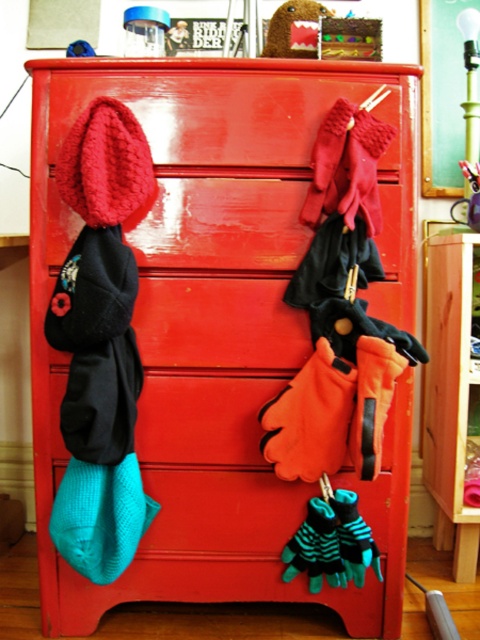
Question: Which point appears farthest from the camera in this image?

Choices:
 (A) (271, 45)
 (B) (68, 538)
 (C) (451, 212)

Answer: (C)

Question: Is teal knitted sock at lower left thinner than metallic silver scissors at upper right?

Choices:
 (A) yes
 (B) no

Answer: (B)

Question: Which of the following is the closest to the observer?

Choices:
 (A) metallic silver scissors at upper right
 (B) teal knitted sock at lower left

Answer: (B)

Question: Does teal knitted sock at lower left appear under metallic silver scissors at upper right?

Choices:
 (A) no
 (B) yes

Answer: (B)

Question: Which object appears farthest from the camera in this image?

Choices:
 (A) teal knitted sock at lower left
 (B) fuzzy brown bear at upper center

Answer: (B)

Question: Is teal knitted sock at lower left smaller than metallic silver scissors at upper right?

Choices:
 (A) yes
 (B) no

Answer: (B)